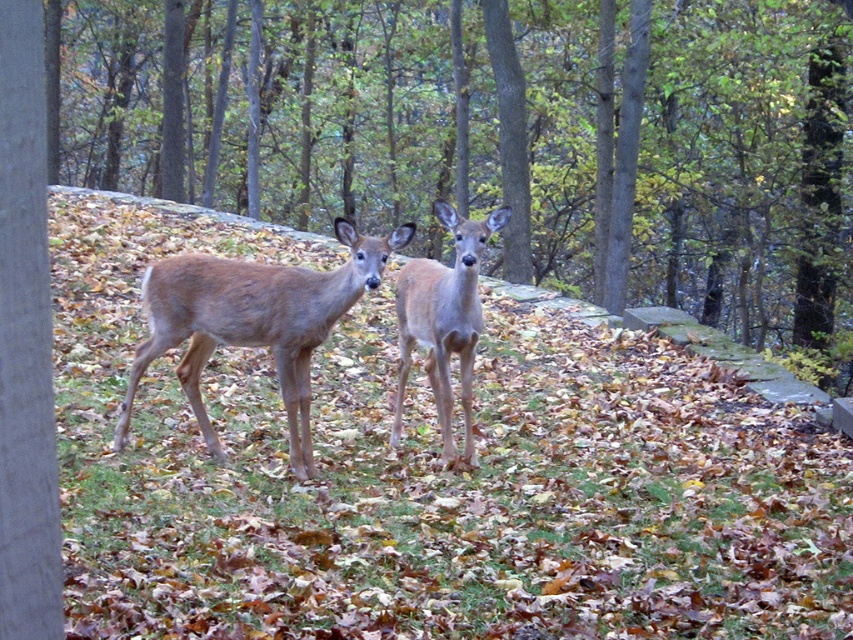
Does point (231, 344) come behind point (479, 300)?

That is False.

Does brown matte/deer at center have a lesser width compared to light brown fur at center?

Incorrect, brown matte/deer at center's width is not less than light brown fur at center's.

Measure the distance between point (363,240) and camera.

Point (363,240) and camera are 6.25 meters apart from each other.

You are a GUI agent. You are given a task and a screenshot of the screen. Output one action in this format:
    pyautogui.click(x=<x>, y=<y>)
    Task: Click on the brown matte/deer at center
    
    Given the screenshot: What is the action you would take?
    pyautogui.click(x=253, y=323)

Which is behind, point (260, 32) or point (404, 268)?

Positioned behind is point (260, 32).

Is brown fur deer at center taller than light brown fur at center?

Correct, brown fur deer at center is much taller as light brown fur at center.

Does point (462, 140) lie behind point (456, 230)?

Yes, point (462, 140) is farther from viewer.

Locate an element on the screen. brown fur deer at center is located at coordinates (585, 147).

Based on the photo, is brown fur deer at center to the right of brown matte/deer at center from the viewer's perspective?

Correct, you'll find brown fur deer at center to the right of brown matte/deer at center.

Between point (625, 256) and point (308, 387), which one is positioned behind?

The point (625, 256) is behind.

The height and width of the screenshot is (640, 853). In order to click on brown fur deer at center in this screenshot , I will do `click(585, 147)`.